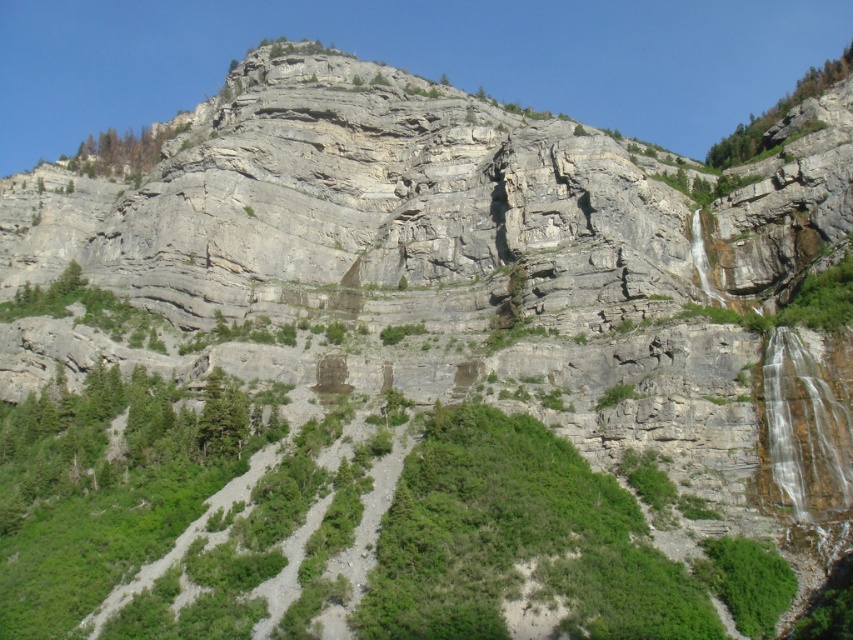
Who is more forward, (x=775, y=113) or (x=120, y=157)?

Positioned in front is point (x=775, y=113).

Describe the element at coordinates (775, 113) in the screenshot. I see `green leafy tree at upper right` at that location.

Identify the location of green leafy tree at upper right. (775, 113).